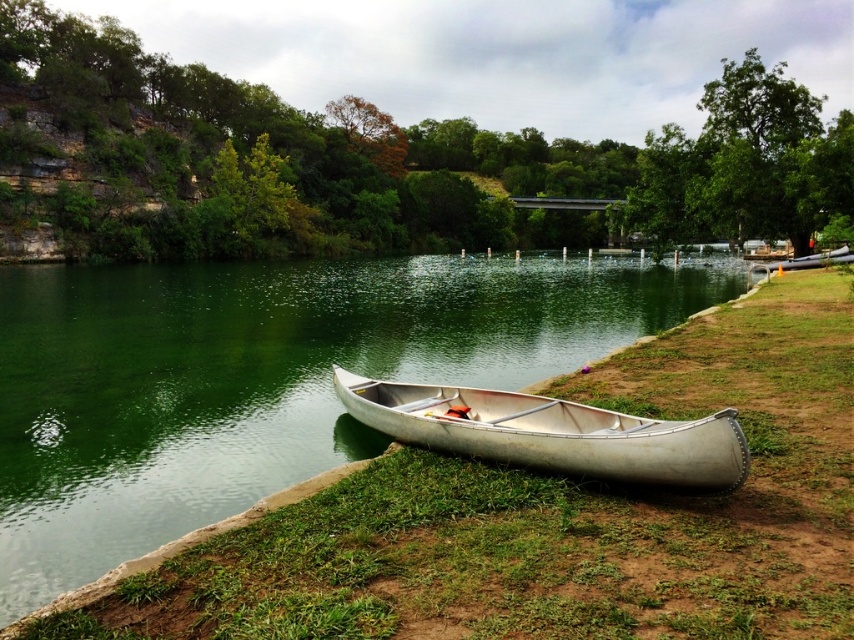
Question: Which point appears farthest from the camera in this image?

Choices:
 (A) (4, 552)
 (B) (468, 390)

Answer: (B)

Question: Is green metallic river at lower left thinner than silver metallic canoe at lower center?

Choices:
 (A) no
 (B) yes

Answer: (A)

Question: Among these points, which one is farthest from the camera?

Choices:
 (A) (382, 404)
 (B) (31, 536)

Answer: (A)

Question: Is green metallic river at lower left to the left of silver metallic canoe at lower center from the viewer's perspective?

Choices:
 (A) no
 (B) yes

Answer: (A)

Question: Does green metallic river at lower left come in front of silver metallic canoe at lower center?

Choices:
 (A) no
 (B) yes

Answer: (B)